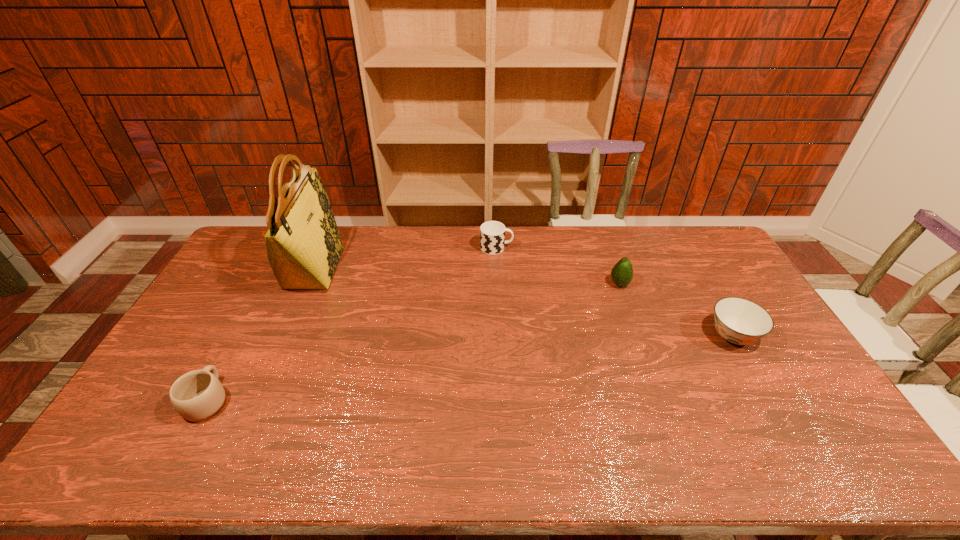
I want to click on the tallest object, so click(x=303, y=244).

What are the coordinates of `the fourth object from left to right` in the screenshot? It's located at tap(622, 273).

What are the coordinates of `the third object from left to right` in the screenshot? It's located at (492, 233).

What are the coordinates of `mug` in the screenshot? It's located at (198, 395).

Find the location of a particular element. This screenshot has width=960, height=540. the rightmost object is located at coordinates (739, 321).

Image resolution: width=960 pixels, height=540 pixels. I want to click on soup bowl, so click(x=739, y=321).

Find the location of `vacant space located 0.110m on the front-facing side of the tote bag`. vacant space located 0.110m on the front-facing side of the tote bag is located at coordinates (367, 268).

At what (x,y) coordinates should I click in order to perform the action: click on vacant area situated on the front of the fourth object from left to right. Please return your answer as a coordinate pair (x, y). Looking at the image, I should click on pos(628,308).

This screenshot has height=540, width=960. I want to click on free region located on the side of the cup with the handle, so click(x=555, y=248).

The image size is (960, 540). I want to click on free space located on the side of the nearest object with the handle, so click(x=270, y=285).